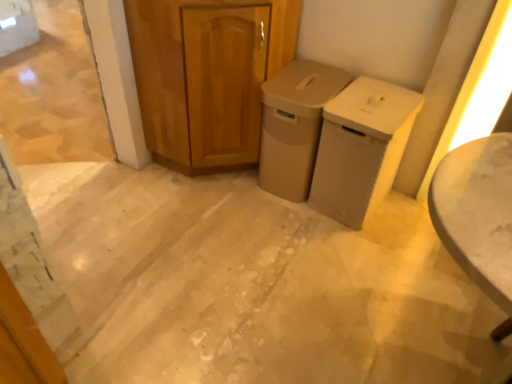
Locate an element on the screen. This screenshot has width=512, height=384. vacant space that is in between wooden cabinet at center and beige matte trash can at center, positioned as the first waste container in left-to-right order is located at coordinates pos(265,202).